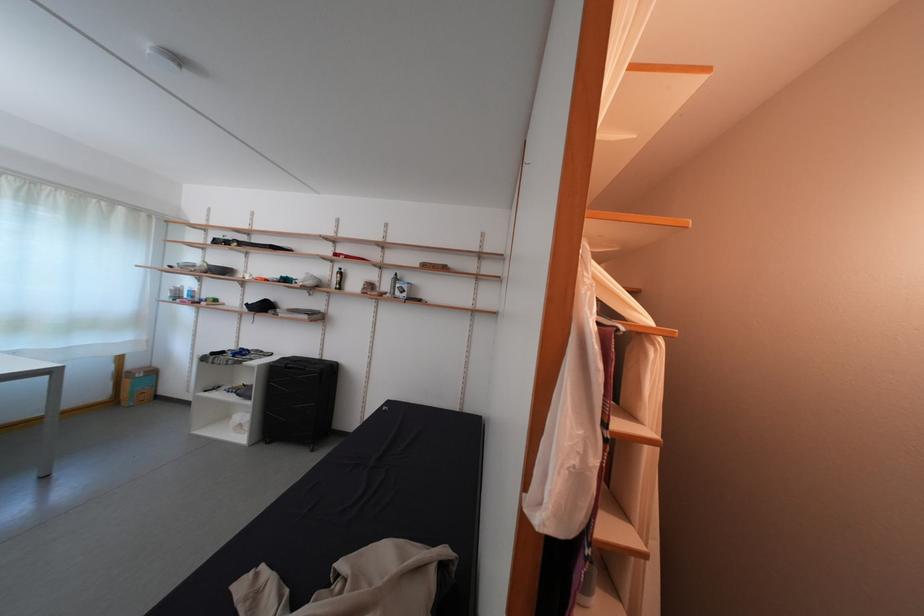
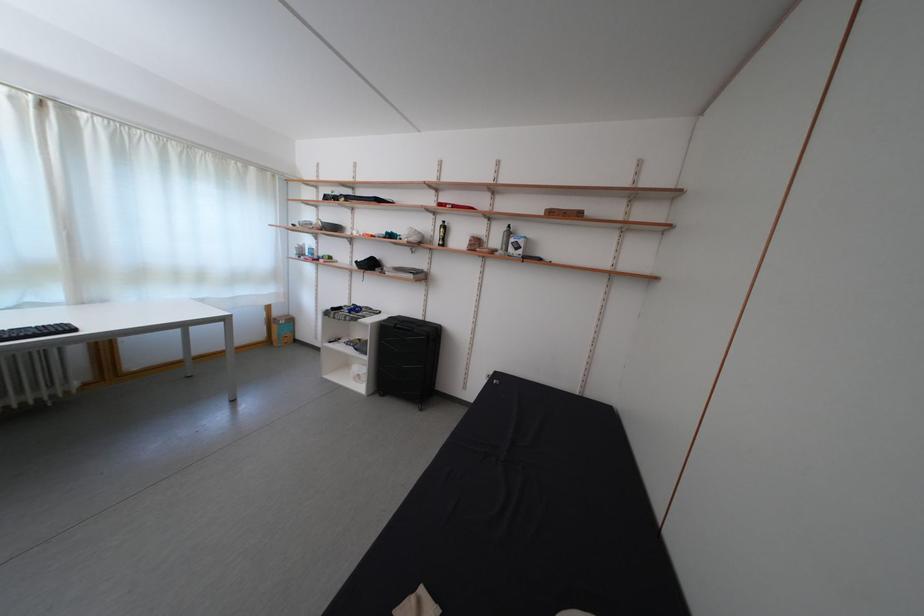
The point at [202,262] is marked in the first image. Where is the corresponding point in the second image?

(319, 221)